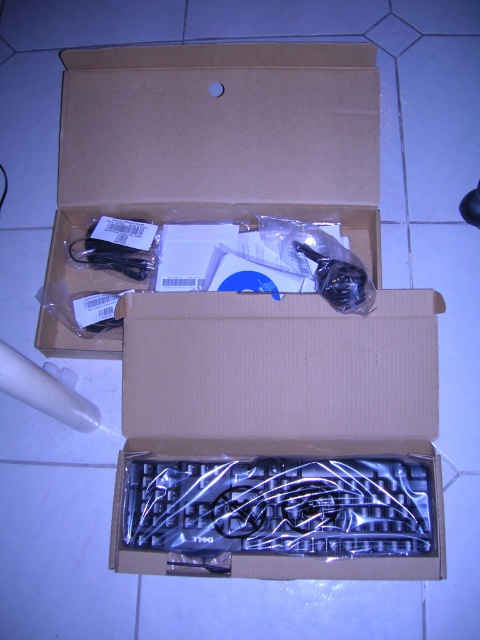
Question: Which point appears farthest from the camera in this image?

Choices:
 (A) (182, 362)
 (B) (348, 236)

Answer: (B)

Question: Is clear plastic keyboard at center to the right of brown cardboard box at upper center from the viewer's perspective?

Choices:
 (A) no
 (B) yes

Answer: (B)

Question: Is clear plastic keyboard at center closer to the viewer compared to brown cardboard box at upper center?

Choices:
 (A) yes
 (B) no

Answer: (A)

Question: Which of the following is the closest to the observer?

Choices:
 (A) clear plastic keyboard at center
 (B) brown cardboard box at upper center

Answer: (A)

Question: Among these points, which one is nearest to the camera?

Choices:
 (A) (132, 429)
 (B) (208, 154)

Answer: (A)

Question: From the image, what is the correct spatial relationship of clear plastic keyboard at center in relation to brown cardboard box at upper center?

Choices:
 (A) left
 (B) right

Answer: (B)